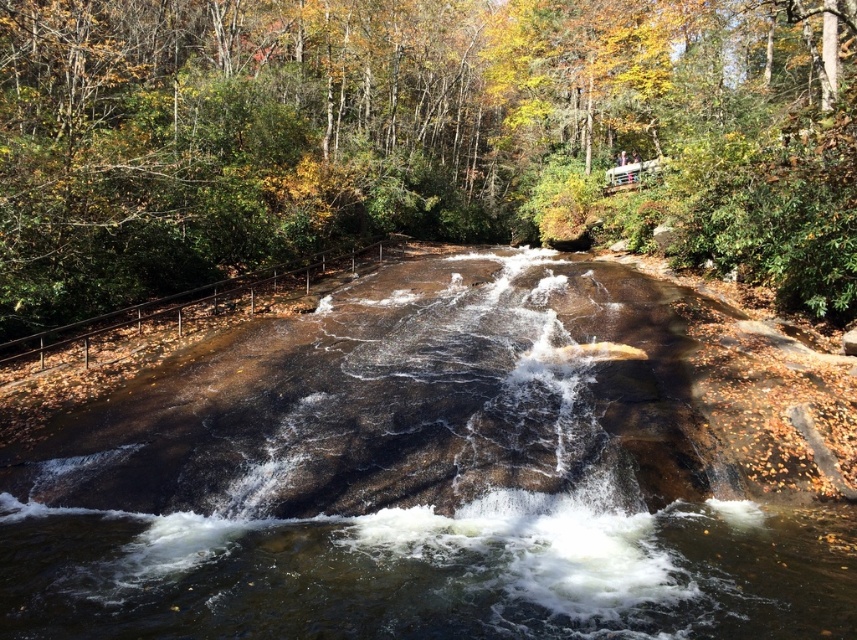
You are standing on the wooden railing along the left side of the waterfall scene. You see the brown rock river at center and the brown textured rock at center. Which of these two objects is positioned further to the left?

The brown rock river at center is positioned to the left of the brown textured rock at center, so it is further to the left.

You are standing at the point labeled as point (412, 481) in the image. What do you see directly in front of you?

You see the brown rock river at center directly in front of you.

You are a hiker standing on the wooden railing along the left side of the waterfall scene. You notice two rocks at the center of the image. Which one is smaller between the brown rock river at center and the brown textured rock at center?

The brown rock river at center is smaller than the brown textured rock at center.